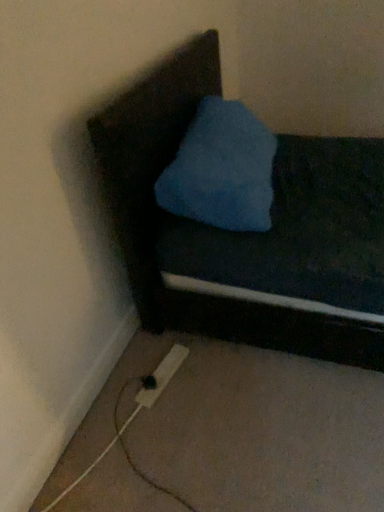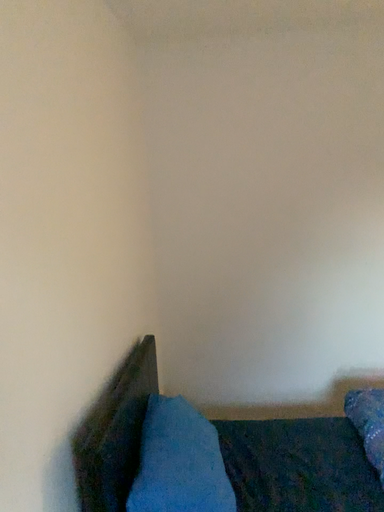
Question: How did the camera likely rotate when shooting the video?

Choices:
 (A) rotated left
 (B) rotated right

Answer: (B)